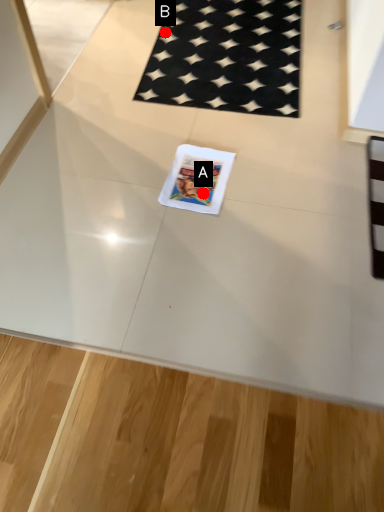
Question: Two points are circled on the image, labeled by A and B beside each circle. Which point is further to the camera?

Choices:
 (A) A is further
 (B) B is further

Answer: (B)